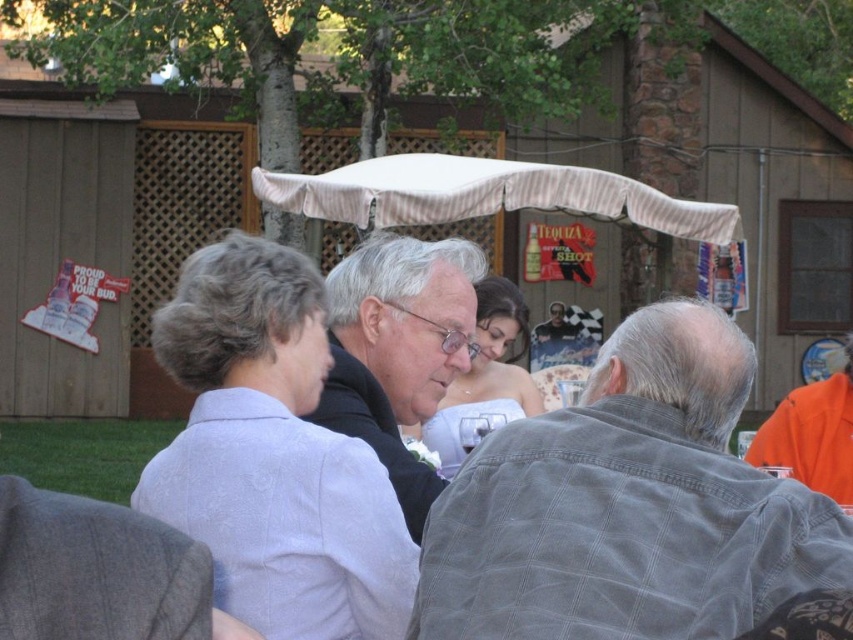
Question: Can you confirm if gray corduroy jacket at center is positioned to the right of matte white dress at center?

Choices:
 (A) no
 (B) yes

Answer: (B)

Question: Which of the following is the closest to the observer?

Choices:
 (A) (367, 340)
 (B) (465, 372)
 (C) (474, 202)
 (D) (305, 364)

Answer: (D)

Question: Where is light purple fabric shirt at upper left located in relation to matte white dress at center in the image?

Choices:
 (A) left
 (B) right

Answer: (A)

Question: Which point is closer to the camera?

Choices:
 (A) (358, 298)
 (B) (380, 214)
 (C) (639, 321)

Answer: (C)

Question: Is gray corduroy jacket at center thinner than white striped canopy at center?

Choices:
 (A) no
 (B) yes

Answer: (B)

Question: Which point is farther to the camera?

Choices:
 (A) pyautogui.click(x=283, y=605)
 (B) pyautogui.click(x=589, y=611)
 (C) pyautogui.click(x=410, y=216)
 (D) pyautogui.click(x=469, y=426)

Answer: (C)